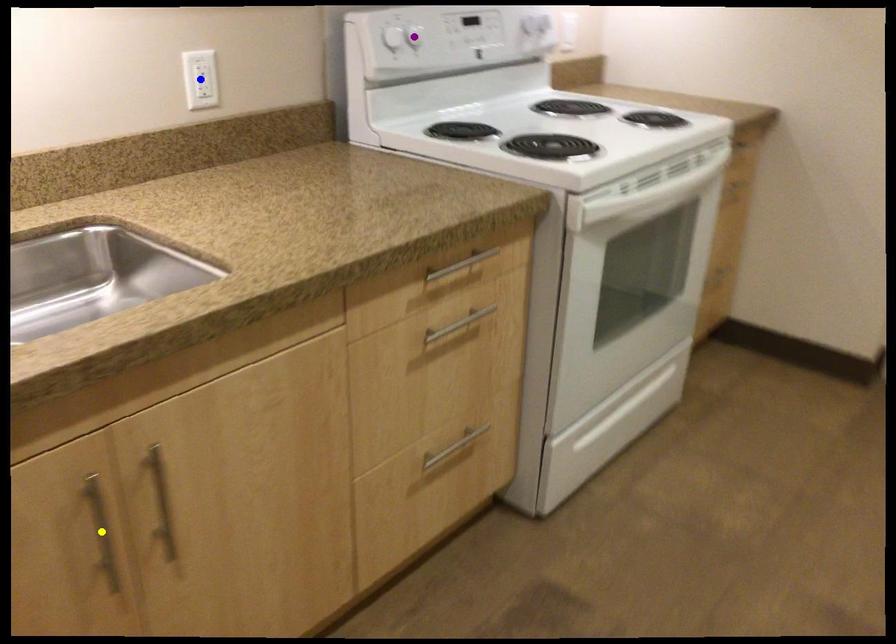
Order these from farthest to nearest:
A) blue point
B) yellow point
C) purple point

purple point < blue point < yellow point